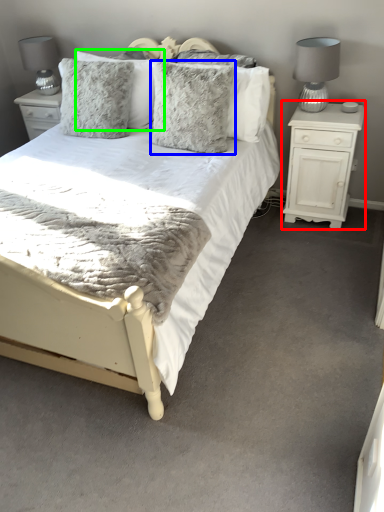
Question: Which is nearer to the nightstand (highlighted by a red box)? pillow (highlighted by a blue box) or pillow (highlighted by a green box).

Choices:
 (A) pillow
 (B) pillow

Answer: (A)